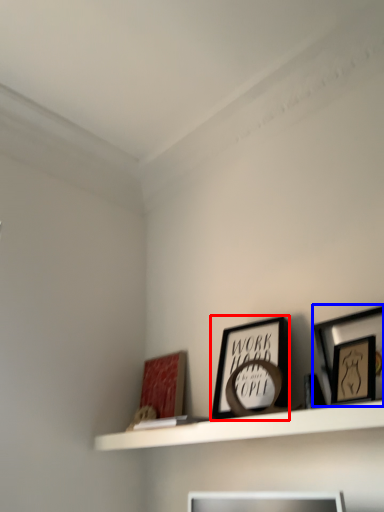
Question: Which of the following is the farthest to the observer, picture frame (highlighted by a red box) or picture frame (highlighted by a blue box)?

Choices:
 (A) picture frame
 (B) picture frame

Answer: (A)